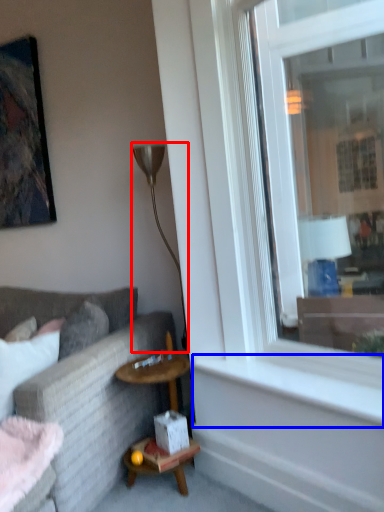
Question: Among these objects, which one is farthest to the camera, lamp (highlighted by a red box) or window sill (highlighted by a blue box)?

Choices:
 (A) lamp
 (B) window sill

Answer: (A)